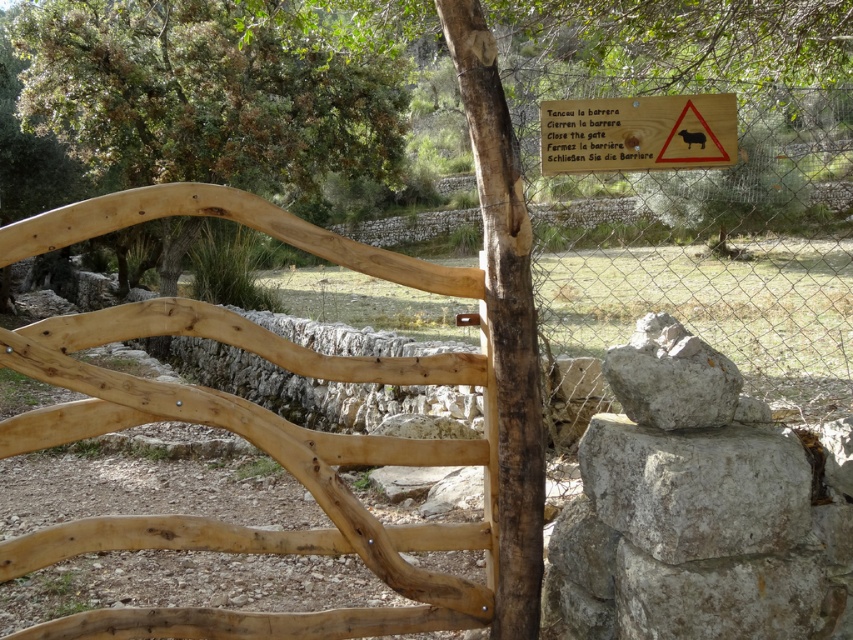
Question: Which object appears closest to the camera in this image?

Choices:
 (A) wooden sign at center
 (B) natural wood gate at center

Answer: (B)

Question: Is natural wood gate at center to the left of gray rough stone at center from the viewer's perspective?

Choices:
 (A) yes
 (B) no

Answer: (A)

Question: Which point is farther from the camera taking this photo?

Choices:
 (A) pos(422,609)
 (B) pos(393,61)
 (C) pos(732,136)
 (D) pos(782,534)

Answer: (B)

Question: Observing the image, what is the correct spatial positioning of gray rough stone at center in reference to wooden sign at center?

Choices:
 (A) left
 (B) right

Answer: (B)

Question: Can you confirm if green leafy tree at upper left is thinner than wooden sign at center?

Choices:
 (A) yes
 (B) no

Answer: (A)

Question: Which object is farther from the camera taking this photo?

Choices:
 (A) gray rough rock at center-right
 (B) wooden sign at center

Answer: (B)